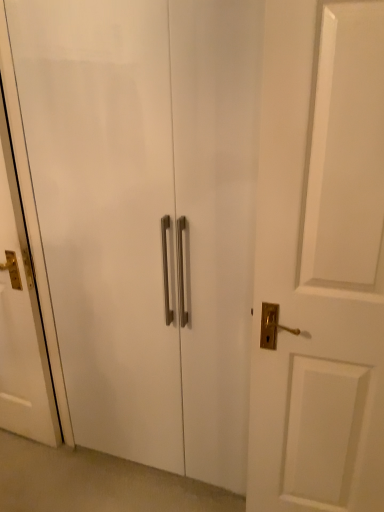
Question: Is white glossy cabinet at center at the left side of white glossy door at left?

Choices:
 (A) no
 (B) yes

Answer: (A)

Question: Is white glossy cabinet at center touching white glossy door at left?

Choices:
 (A) yes
 (B) no

Answer: (B)

Question: Is white glossy cabinet at center positioned with its back to white glossy door at left?

Choices:
 (A) no
 (B) yes

Answer: (A)

Question: Is white glossy cabinet at center far from white glossy door at left?

Choices:
 (A) yes
 (B) no

Answer: (B)

Question: Considering the relative sizes of white glossy cabinet at center and white glossy door at left in the image provided, is white glossy cabinet at center thinner than white glossy door at left?

Choices:
 (A) yes
 (B) no

Answer: (A)

Question: Is white glossy cabinet at center aimed at white glossy door at left?

Choices:
 (A) no
 (B) yes

Answer: (A)

Question: From the image's perspective, is white glossy door at left below white glossy cabinet at center?

Choices:
 (A) yes
 (B) no

Answer: (B)

Question: From a real-world perspective, is white glossy door at left under white glossy cabinet at center?

Choices:
 (A) yes
 (B) no

Answer: (A)

Question: Is the depth of white glossy door at left greater than that of white glossy cabinet at center?

Choices:
 (A) yes
 (B) no

Answer: (A)

Question: Is white glossy door at left turned away from white glossy cabinet at center?

Choices:
 (A) yes
 (B) no

Answer: (B)

Question: Does white glossy door at left have a larger size compared to white glossy cabinet at center?

Choices:
 (A) no
 (B) yes

Answer: (A)

Question: Does white glossy door at left have a greater width compared to white glossy cabinet at center?

Choices:
 (A) yes
 (B) no

Answer: (A)

Question: Looking at their shapes, would you say white glossy door at left is wider or thinner than white glossy cabinet at center?

Choices:
 (A) wide
 (B) thin

Answer: (A)